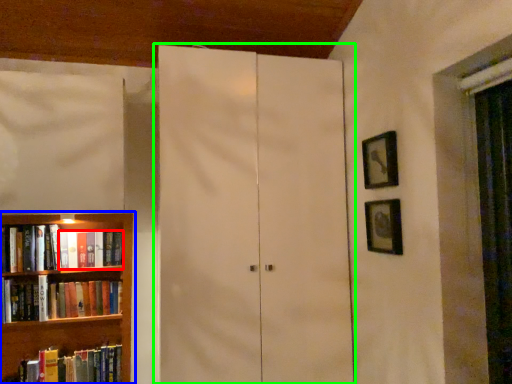
Question: Based on their relative distances, which object is farther from book (highlighted by a red box)? Choose from bookcase (highlighted by a blue box) and cupboard (highlighted by a green box).

Choices:
 (A) bookcase
 (B) cupboard

Answer: (B)